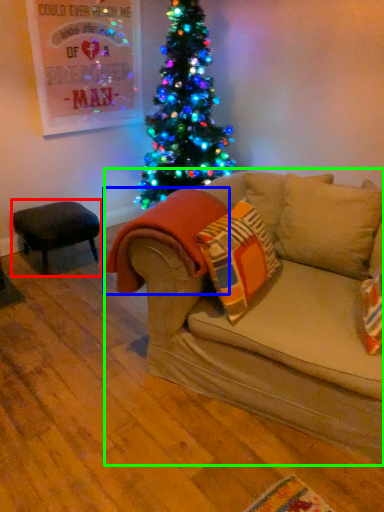
Question: Which object is the closest to the stool (highlighted by a red box)? Choose among these: blanket (highlighted by a blue box) or studio couch (highlighted by a green box).

Choices:
 (A) blanket
 (B) studio couch

Answer: (A)